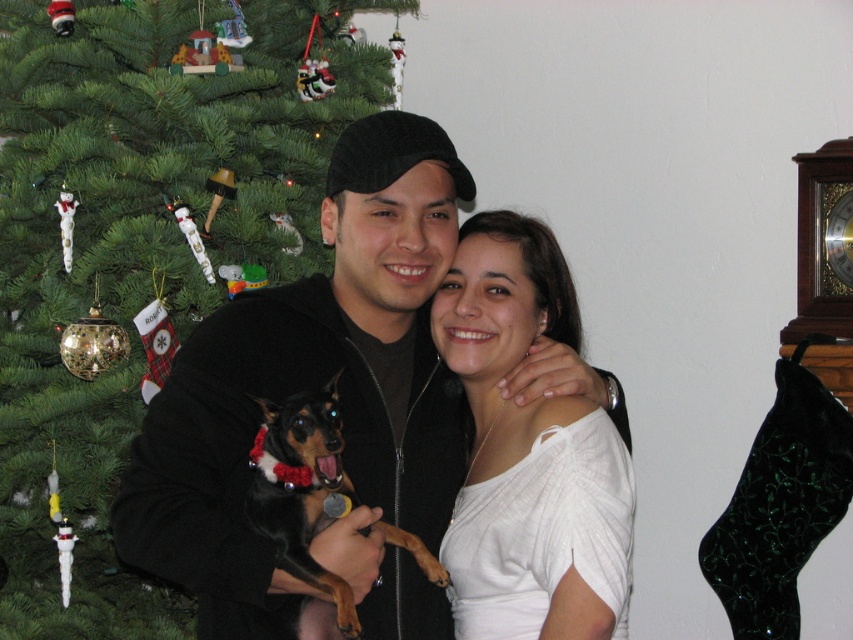
You are standing in the room and want to take a photo of the green matte christmas tree at left and the black fleece jacket at center. Which object should you focus on first if you want to capture both in the same frame without moving the camera?

You should focus on the black fleece jacket at center first because the green matte christmas tree at left is located above it, so adjusting focus to the lower object ensures both are in the frame.

In the scene shown: You are standing in front of the Christmas tree and want to place a decoration at point A and point B. Point A is at coordinate point(123, 115) and point B is at coordinate point(328, 321). Which point is closer to you?

Point A at coordinate point(123, 115) is closer to you than point B at coordinate point(328, 321) because it is further to the viewer.

You are a photographer setting up for a family photo. The green matte christmas tree at left and the white matte shirt at center are in the frame. If you want to ensure both are in focus, what should you consider about their distance?

The green matte christmas tree at left is 31.55 inches from the white matte shirt at center. To ensure both are in focus, you should consider the depth of field required to cover this distance.